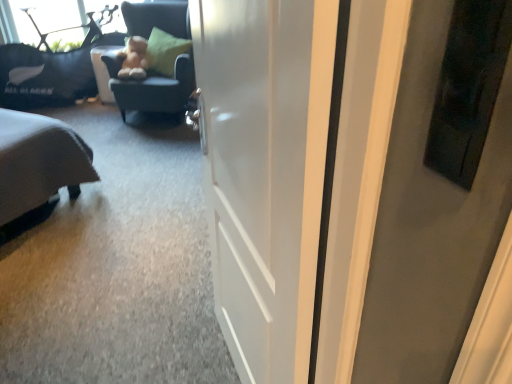
Question: From a real-world perspective, is white glossy door at center over fuzzy brown teddy bear at upper center?

Choices:
 (A) yes
 (B) no

Answer: (A)

Question: From a real-world perspective, is white glossy door at center beneath fuzzy brown teddy bear at upper center?

Choices:
 (A) yes
 (B) no

Answer: (B)

Question: Does white glossy door at center have a lesser width compared to fuzzy brown teddy bear at upper center?

Choices:
 (A) no
 (B) yes

Answer: (B)

Question: Considering the relative sizes of white glossy door at center and fuzzy brown teddy bear at upper center in the image provided, is white glossy door at center taller than fuzzy brown teddy bear at upper center?

Choices:
 (A) yes
 (B) no

Answer: (A)

Question: Considering the relative sizes of white glossy door at center and fuzzy brown teddy bear at upper center in the image provided, is white glossy door at center smaller than fuzzy brown teddy bear at upper center?

Choices:
 (A) no
 (B) yes

Answer: (A)

Question: Which is correct: black fabric couch at upper left is inside white glossy door at center, or outside of it?

Choices:
 (A) outside
 (B) inside

Answer: (A)

Question: From the image's perspective, relative to white glossy door at center, is black fabric couch at upper left above or below?

Choices:
 (A) above
 (B) below

Answer: (A)

Question: Considering their positions, is black fabric couch at upper left located in front of or behind white glossy door at center?

Choices:
 (A) front
 (B) behind

Answer: (B)

Question: From a real-world perspective, relative to white glossy door at center, is black fabric couch at upper left vertically above or below?

Choices:
 (A) below
 (B) above

Answer: (A)

Question: Considering the positions of fuzzy brown teddy bear at upper center and black fabric couch at upper left in the image, is fuzzy brown teddy bear at upper center wider or thinner than black fabric couch at upper left?

Choices:
 (A) thin
 (B) wide

Answer: (B)

Question: In the image, is fuzzy brown teddy bear at upper center positioned in front of or behind black fabric couch at upper left?

Choices:
 (A) behind
 (B) front

Answer: (B)

Question: Based on their sizes in the image, would you say fuzzy brown teddy bear at upper center is bigger or smaller than black fabric couch at upper left?

Choices:
 (A) small
 (B) big

Answer: (A)

Question: Is point (142, 54) closer or farther from the camera than point (67, 71)?

Choices:
 (A) farther
 (B) closer

Answer: (B)

Question: Looking at their shapes, would you say fuzzy brown teddy bear at upper center is wider or thinner than dark blue fabric chair at upper left?

Choices:
 (A) thin
 (B) wide

Answer: (A)

Question: From the image's perspective, relative to dark blue fabric chair at upper left, is fuzzy brown teddy bear at upper center above or below?

Choices:
 (A) below
 (B) above

Answer: (B)